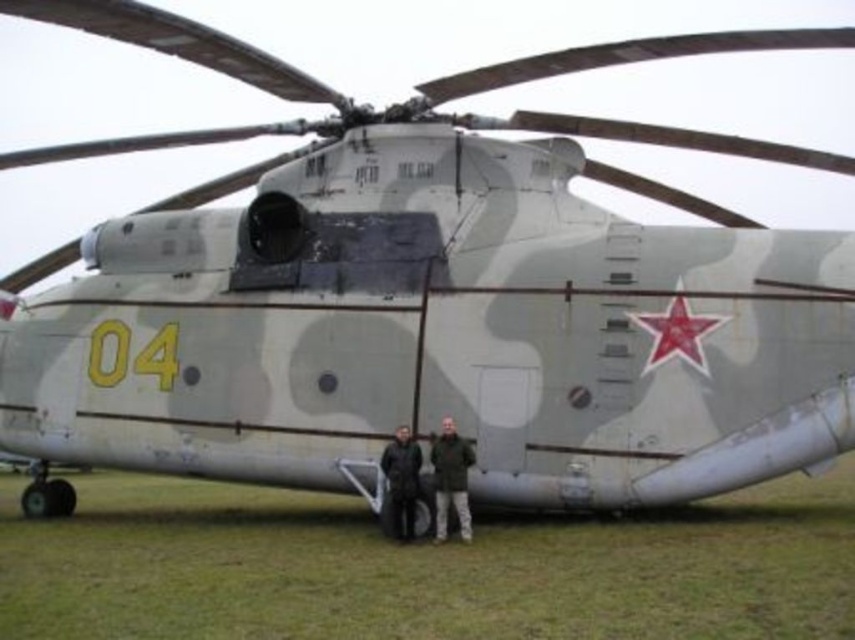
You are a drone operator controlling a drone that needs to maintain a minimum distance of 50 meters from any object to avoid collision. You are currently flying your drone near the helicopter in the image. There is a specific point at coordinates point (789, 477) that you need to fly over. Based on the information provided, can your drone safely fly over that point without violating the minimum distance requirement?

The distance of point (789, 477) from camera is 62.62 meters, which is greater than the minimum required distance of 50 meters. Therefore, the drone can safely fly over point (789, 477) without violating the minimum distance requirement.

You are a photographer wanting to capture the Mil Mi 26 helicopter in the image. You notice the green grass at lower center and the dark green fabric jacket at center. Which object is taller when viewed from the front?

The green grass at lower center is taller than the dark green fabric jacket at center.